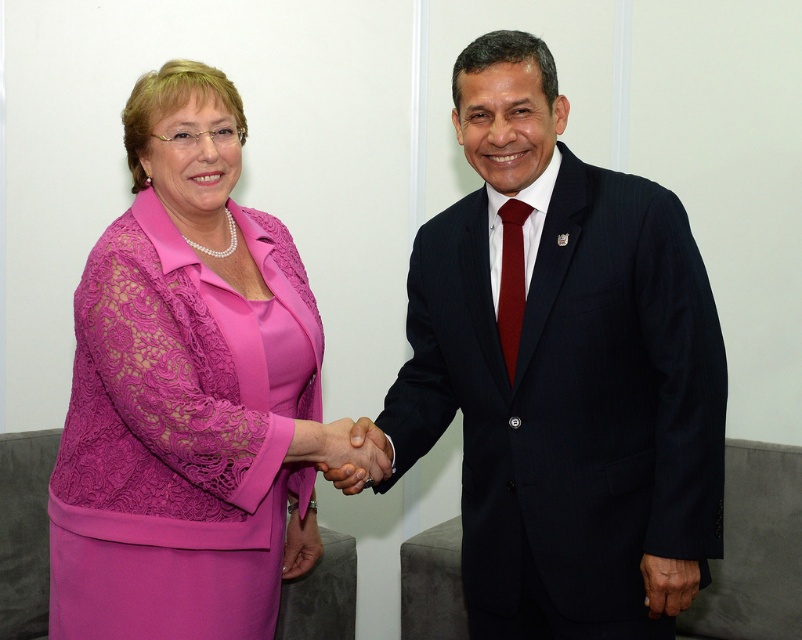
Can you confirm if matte pink dress at center is positioned below smooth skin handshake at center?

No, matte pink dress at center is not below smooth skin handshake at center.

How far apart are matte pink dress at center and smooth skin handshake at center?

matte pink dress at center is 11.05 inches away from smooth skin handshake at center.

Which is in front, point (63, 550) or point (355, 428)?

Point (63, 550) is in front.

The height and width of the screenshot is (640, 802). I want to click on matte pink dress at center, so click(184, 388).

Does point (488, 323) come behind point (385, 476)?

That is False.

Which is behind, point (474, 93) or point (371, 433)?

Point (371, 433)

Locate an element on the screen. dark blue pinstripe suit at center is located at coordinates (562, 371).

Which is above, dark blue pinstripe suit at center or pink fabric hand at center?

dark blue pinstripe suit at center

From the picture: Is dark blue pinstripe suit at center above pink fabric hand at center?

Yes.

Is point (484, 536) behind point (292, 557)?

No, it is in front of (292, 557).

Identify the location of dark blue pinstripe suit at center. (562, 371).